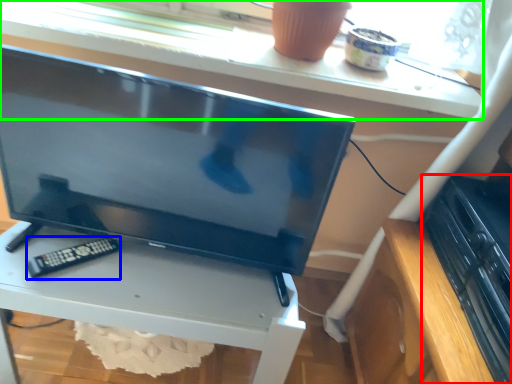
Question: Which object is the farthest from appliance (highlighted by a red box)? Choose among these: control (highlighted by a blue box) or window sill (highlighted by a green box).

Choices:
 (A) control
 (B) window sill

Answer: (A)